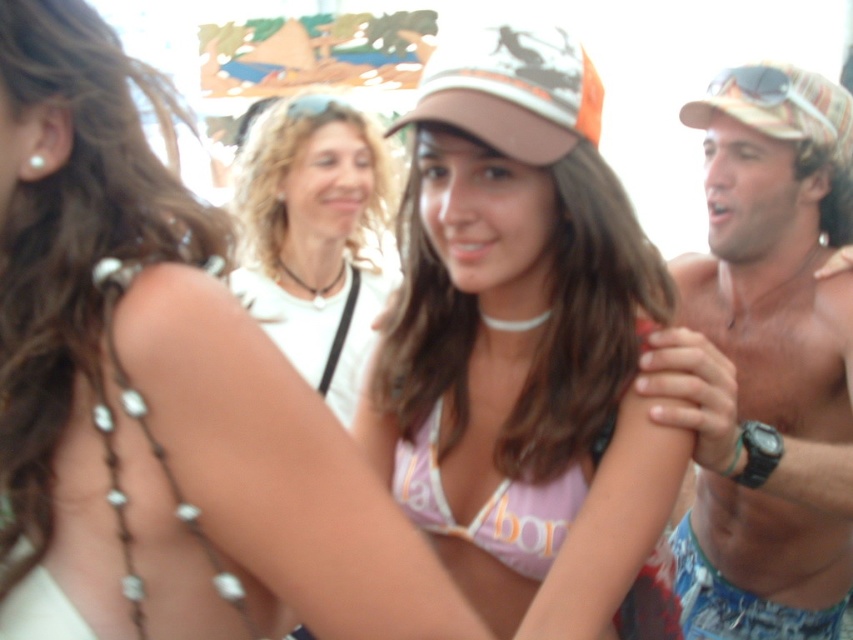
Question: Which object is the farthest from the camouflage fabric baseball cap at upper right?

Choices:
 (A) camouflage fabric baseball cap at center
 (B) matte pink bikini top at center

Answer: (B)

Question: Is the position of matte pink bikini top at center less distant than that of camouflage fabric cap at right?

Choices:
 (A) no
 (B) yes

Answer: (B)

Question: Which object is farther from the camera taking this photo?

Choices:
 (A) white matte shirt at center
 (B) pink fabric bikini top at center
 (C) camouflage fabric baseball cap at upper right
 (D) matte pink bikini top at center

Answer: (A)

Question: Does matte pink bikini top at center appear under camouflage fabric baseball cap at center?

Choices:
 (A) yes
 (B) no

Answer: (A)

Question: Which of the following is the closest to the observer?

Choices:
 (A) (543, 545)
 (B) (527, 29)
 (C) (283, 244)
 (D) (715, 83)

Answer: (B)

Question: Can you confirm if matte pink bikini top at center is smaller than camouflage fabric baseball cap at upper right?

Choices:
 (A) yes
 (B) no

Answer: (B)